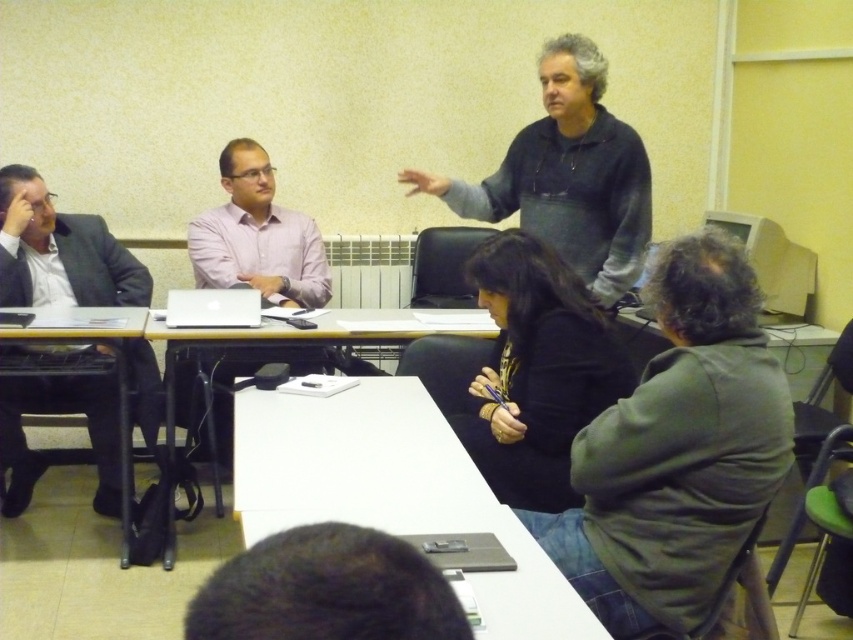
Question: Estimate the real-world distances between objects in this image. Which object is farther from the white matte table at lower center?

Choices:
 (A) dark brown hair at lower center
 (B) white matte laptop at center

Answer: (A)

Question: Can you confirm if black matte jacket at lower center is wider than white matte laptop at center?

Choices:
 (A) yes
 (B) no

Answer: (A)

Question: Is white matte table at lower center to the right of white glossy table at center from the viewer's perspective?

Choices:
 (A) yes
 (B) no

Answer: (A)

Question: Is dark green hoodie at lower right thinner than pink matte shirt at center?

Choices:
 (A) yes
 (B) no

Answer: (A)

Question: Which of these objects is positioned farthest from the matte black suit at left?

Choices:
 (A) black matte jacket at lower center
 (B) dark brown hair at lower center
 (C) dark green hoodie at lower right

Answer: (B)

Question: Among these objects, which one is farthest from the camera?

Choices:
 (A) dark gray hoodie at upper center
 (B) white matte laptop at center

Answer: (B)